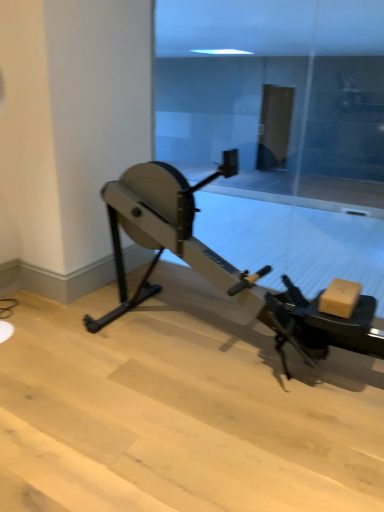
Identify the location of free space on the front side of transparent glass door at center. Image resolution: width=384 pixels, height=512 pixels. (220, 389).